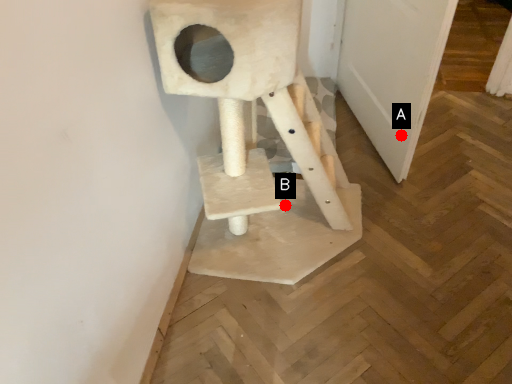
Question: Two points are circled on the image, labeled by A and B beside each circle. Among these points, which one is nearest to the camera?

Choices:
 (A) A is closer
 (B) B is closer

Answer: (A)